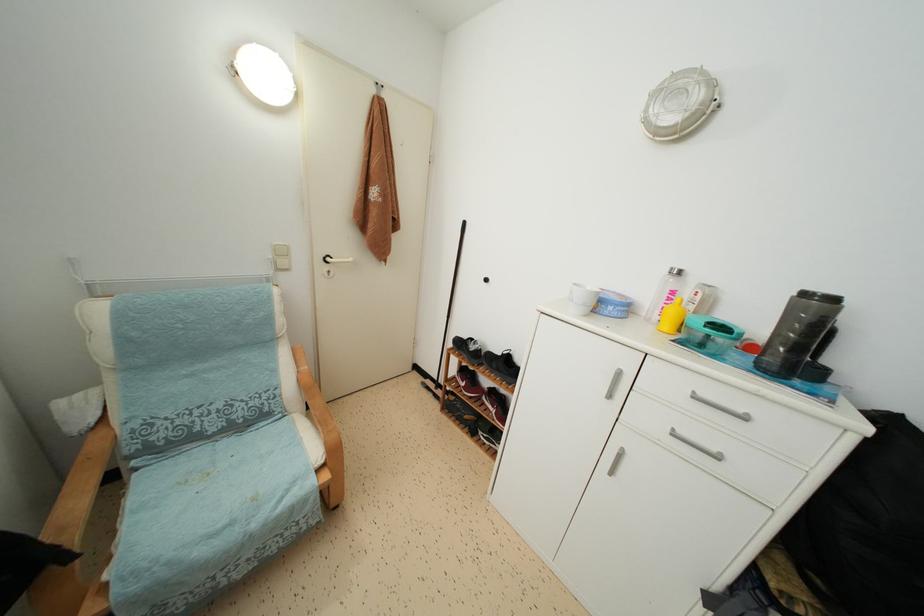
Where would you lift the white mug? Please return your answer as a coordinate pair (x, y).

(581, 299)